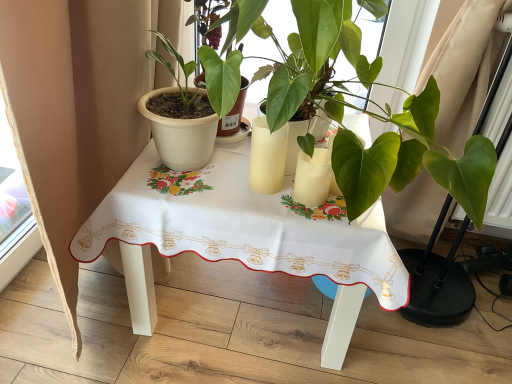
Question: In which direction should I rotate to look at matte white candle at center, the second candle holder in the left-to-right sequence?

Choices:
 (A) right
 (B) left

Answer: (A)

Question: From the image's perspective, is green matte plant at center, which ranks as the 2th houseplant in left-to-right order, under matte yellow glass at center, the second candle holder in the right-to-left sequence?

Choices:
 (A) no
 (B) yes

Answer: (A)

Question: Could you tell me if green matte plant at center, positioned as the 1th houseplant in right-to-left order, is turned towards matte yellow glass at center, the second candle holder in the right-to-left sequence?

Choices:
 (A) yes
 (B) no

Answer: (A)

Question: Does green matte plant at center, which ranks as the 2th houseplant in left-to-right order, have a greater width compared to matte yellow glass at center, the second candle holder in the right-to-left sequence?

Choices:
 (A) yes
 (B) no

Answer: (A)

Question: Is there a large distance between green matte plant at center, which ranks as the 2th houseplant in left-to-right order, and matte yellow glass at center, the second candle holder in the right-to-left sequence?

Choices:
 (A) yes
 (B) no

Answer: (B)

Question: From a real-world perspective, is green matte plant at center, which ranks as the 2th houseplant in left-to-right order, over matte yellow glass at center, the second candle holder in the right-to-left sequence?

Choices:
 (A) yes
 (B) no

Answer: (A)

Question: Can you confirm if green matte plant at center, positioned as the 1th houseplant in right-to-left order, is shorter than matte yellow glass at center, the second candle holder in the right-to-left sequence?

Choices:
 (A) yes
 (B) no

Answer: (B)

Question: Can you confirm if white fabric table at center is thinner than green matte plant at center, positioned as the 1th houseplant in right-to-left order?

Choices:
 (A) no
 (B) yes

Answer: (A)

Question: From the image's perspective, is white fabric table at center over green matte plant at center, which ranks as the 2th houseplant in left-to-right order?

Choices:
 (A) yes
 (B) no

Answer: (B)

Question: From a real-world perspective, is white fabric table at center physically below green matte plant at center, which ranks as the 2th houseplant in left-to-right order?

Choices:
 (A) yes
 (B) no

Answer: (A)

Question: Does white fabric table at center have a greater height compared to green matte plant at center, positioned as the 1th houseplant in right-to-left order?

Choices:
 (A) yes
 (B) no

Answer: (B)

Question: Is white fabric table at center not within green matte plant at center, positioned as the 1th houseplant in right-to-left order?

Choices:
 (A) no
 (B) yes

Answer: (B)

Question: Considering the relative sizes of white fabric table at center and green matte plant at center, positioned as the 1th houseplant in right-to-left order, in the image provided, is white fabric table at center wider than green matte plant at center, positioned as the 1th houseplant in right-to-left order,?

Choices:
 (A) no
 (B) yes

Answer: (B)

Question: From a real-world perspective, is matte yellow glass at center, the second candle holder in the right-to-left sequence, over matte white pot at left, which ranks as the second houseplant in right-to-left order?

Choices:
 (A) no
 (B) yes

Answer: (A)